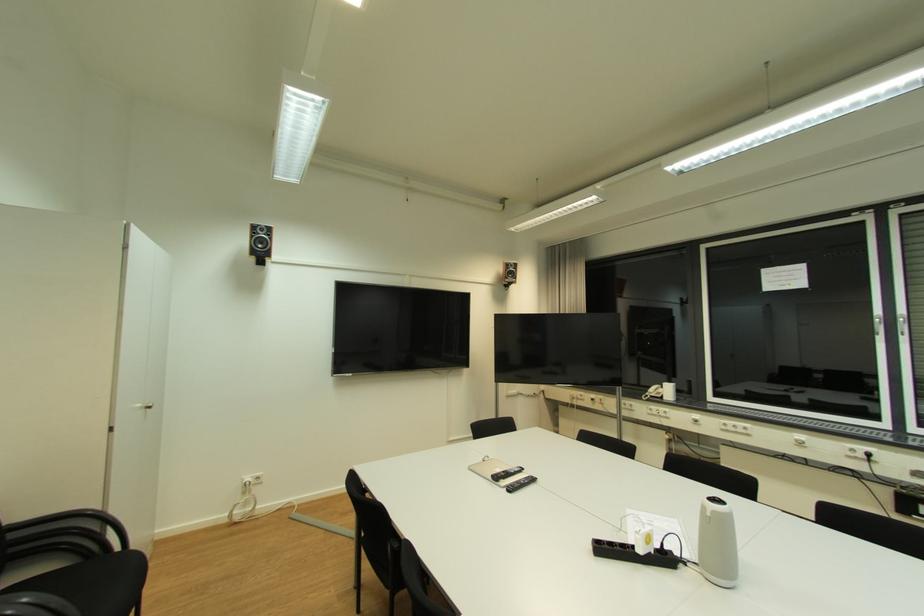
The image size is (924, 616). What do you see at coordinates (652, 392) in the screenshot?
I see `a white telephone handset` at bounding box center [652, 392].